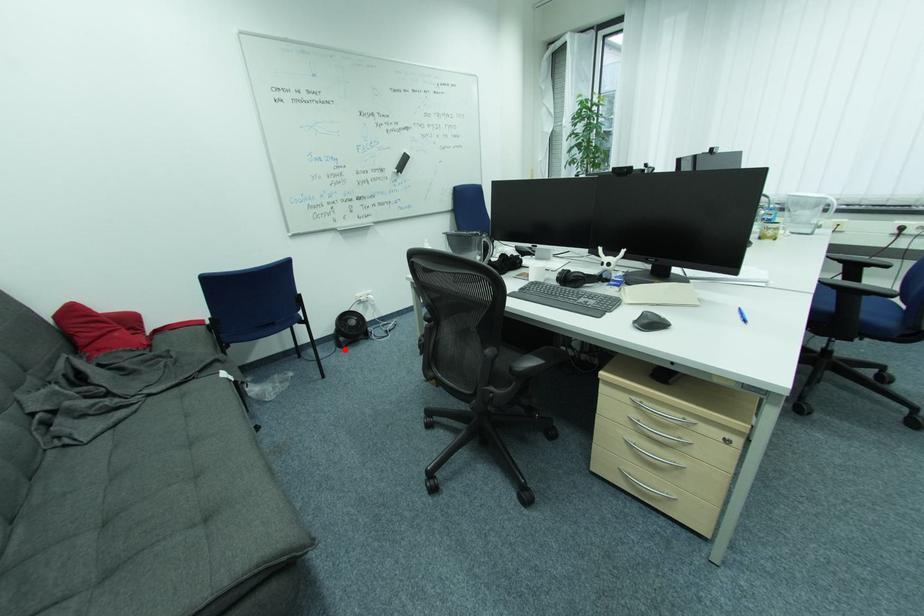
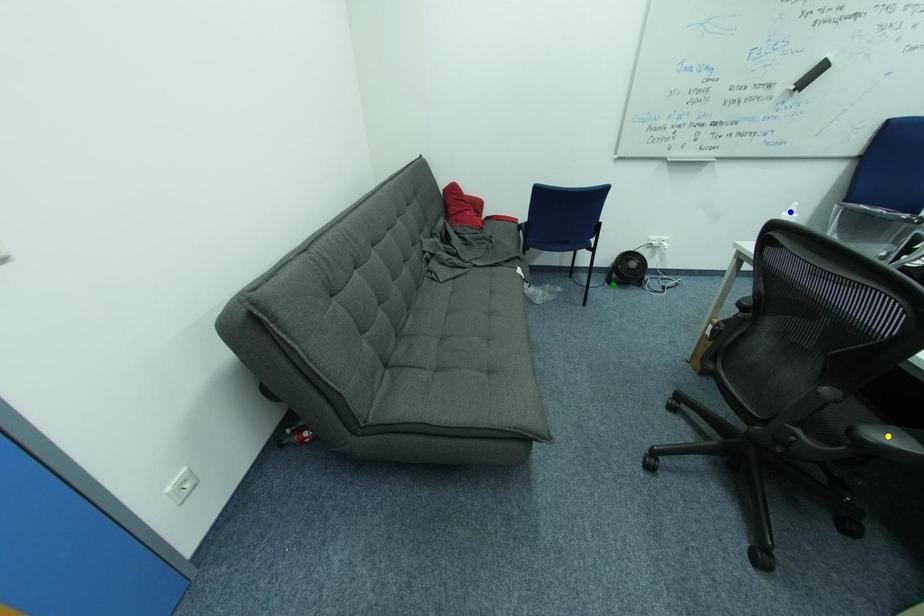
Question: I am providing you with two images of the same scene from different viewpoints. A red point is marked on the first image. You are given multiple points on the second image. Which mark in image 2 goes with the point in image 1?

Choices:
 (A) blue point
 (B) green point
 (C) yellow point

Answer: (B)